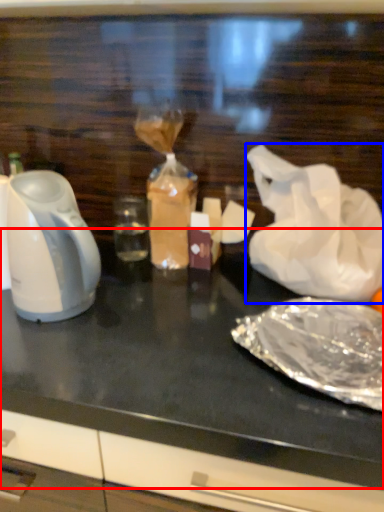
Question: Which object appears closest to the camera in this image, table top (highlighted by a red box) or plastic bag (highlighted by a blue box)?

Choices:
 (A) table top
 (B) plastic bag

Answer: (A)